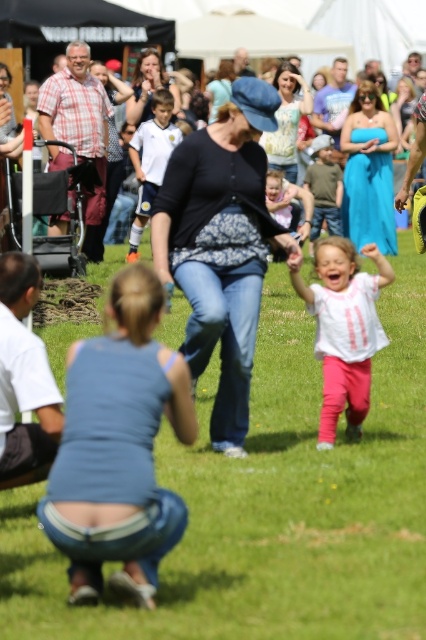
Question: Which of the following is the closest to the observer?

Choices:
 (A) [x=9, y=61]
 (B) [x=216, y=188]

Answer: (B)

Question: Which object is the closest to the white matte shirt at center?

Choices:
 (A) green grass at center
 (B) matte black hat at center

Answer: (A)

Question: Which of the following is the closest to the observer?

Choices:
 (A) matte black hat at center
 (B) blue denim jeans at center
 (C) light pink fabric dress at center
 (D) white matte shirt at center

Answer: (B)

Question: Can you confirm if white matte shirt at center is positioned below light pink fabric dress at center?

Choices:
 (A) yes
 (B) no

Answer: (A)

Question: Is blue denim jeans at center wider than white matte shirt at center?

Choices:
 (A) yes
 (B) no

Answer: (A)

Question: Is the position of white matte shirt at center less distant than that of matte black hat at center?

Choices:
 (A) no
 (B) yes

Answer: (B)